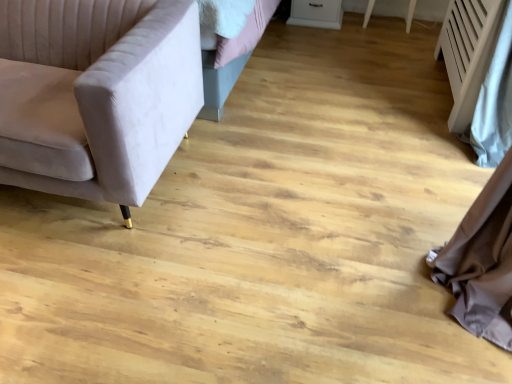
Question: Would you say white textured radiator at right contains velvet beige couch at left?

Choices:
 (A) no
 (B) yes

Answer: (A)

Question: Is white textured radiator at right facing towards velvet beige couch at left?

Choices:
 (A) yes
 (B) no

Answer: (A)

Question: Is white textured radiator at right taller than velvet beige couch at left?

Choices:
 (A) yes
 (B) no

Answer: (A)

Question: Is white textured radiator at right not near velvet beige couch at left?

Choices:
 (A) no
 (B) yes

Answer: (B)

Question: From the image's perspective, is white textured radiator at right on velvet beige couch at left?

Choices:
 (A) yes
 (B) no

Answer: (A)

Question: Considering the relative sizes of white textured radiator at right and velvet beige couch at left in the image provided, is white textured radiator at right shorter than velvet beige couch at left?

Choices:
 (A) no
 (B) yes

Answer: (A)

Question: From the image's perspective, would you say white glossy drawer at upper center is positioned over velvet beige couch at left?

Choices:
 (A) yes
 (B) no

Answer: (A)

Question: Is white glossy drawer at upper center outside velvet beige couch at left?

Choices:
 (A) no
 (B) yes

Answer: (B)

Question: Is white glossy drawer at upper center facing towards velvet beige couch at left?

Choices:
 (A) no
 (B) yes

Answer: (B)

Question: Is white glossy drawer at upper center at the right side of velvet beige couch at left?

Choices:
 (A) yes
 (B) no

Answer: (A)

Question: Can you confirm if white glossy drawer at upper center is thinner than velvet beige couch at left?

Choices:
 (A) no
 (B) yes

Answer: (B)

Question: Does white glossy drawer at upper center have a lesser height compared to velvet beige couch at left?

Choices:
 (A) yes
 (B) no

Answer: (A)

Question: Is white textured radiator at right turned away from white glossy drawer at upper center?

Choices:
 (A) no
 (B) yes

Answer: (A)